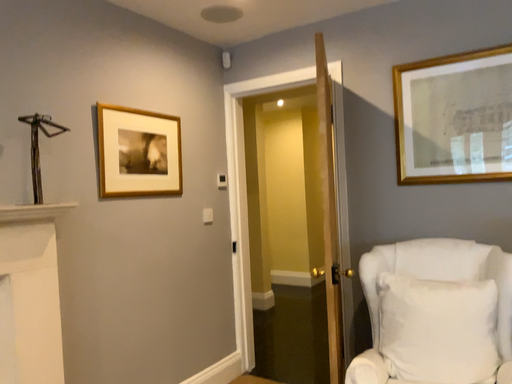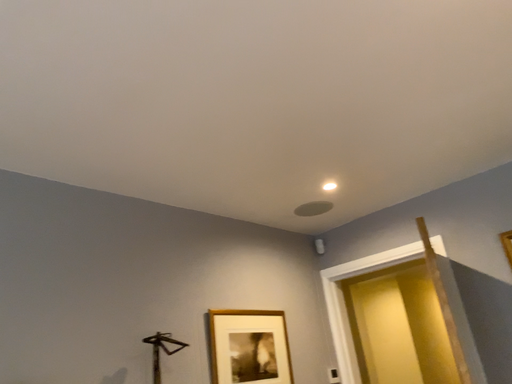
Question: How did the camera likely rotate when shooting the video?

Choices:
 (A) rotated downward
 (B) rotated upward

Answer: (B)